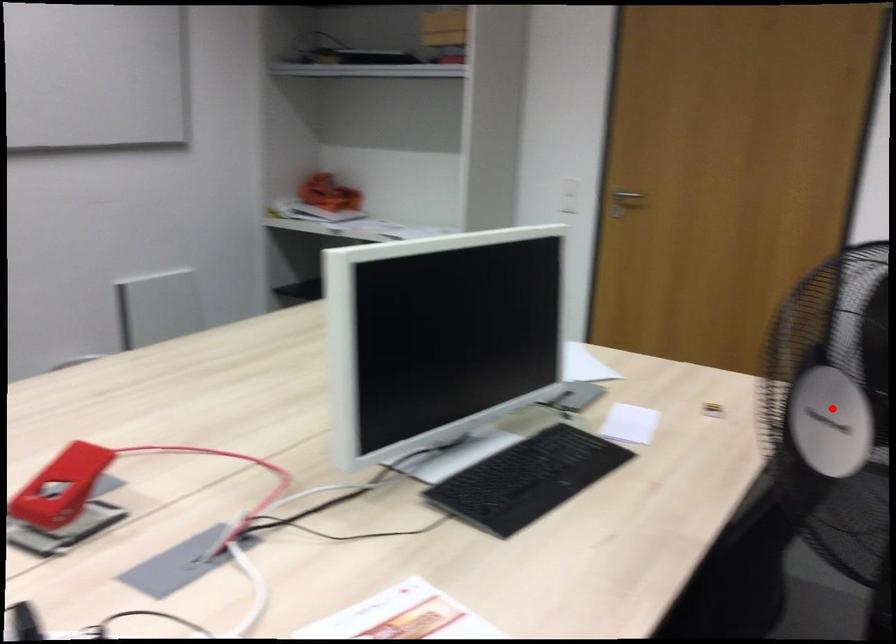
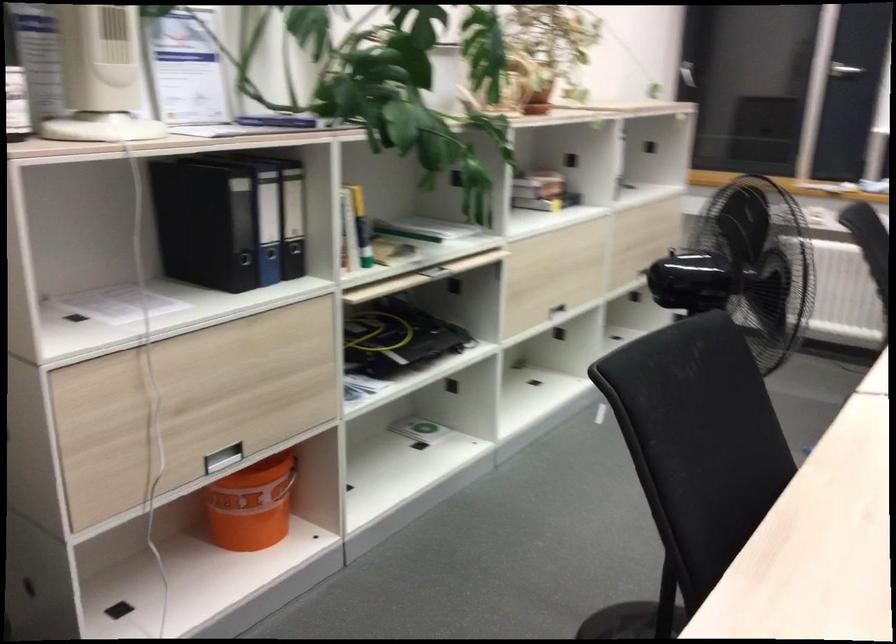
Question: I am providing you with two images of the same scene from different viewpoints. A red point is marked on the first image. Can you still see the location of the red point in image 2?

Choices:
 (A) Yes
 (B) No

Answer: (B)